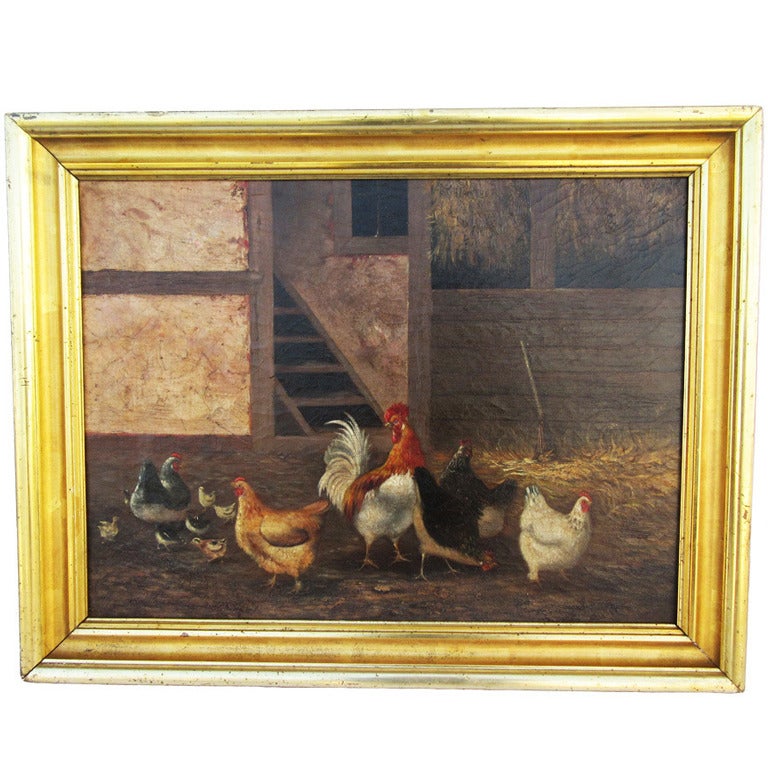
The width and height of the screenshot is (768, 768). Find the location of `stairs`. stairs is located at coordinates (302, 355).